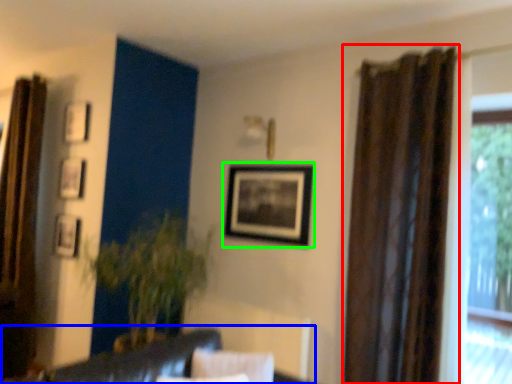
Question: Estimate the real-world distances between objects in this image. Which object is farther from curtain (highlighted by a red box), couch (highlighted by a blue box) or picture frame (highlighted by a green box)?

Choices:
 (A) couch
 (B) picture frame

Answer: (A)